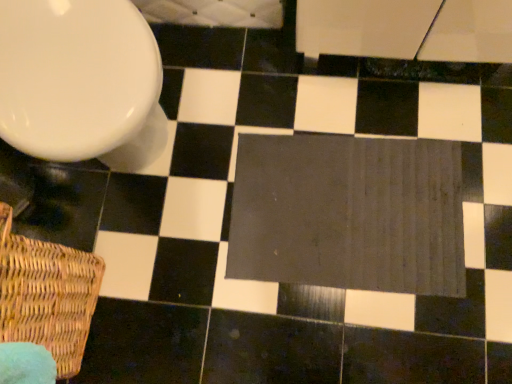
Question: Does dark gray fabric bath mat at center appear on the left side of woven brown basket at lower left?

Choices:
 (A) yes
 (B) no

Answer: (B)

Question: From the image's perspective, is dark gray fabric bath mat at center over woven brown basket at lower left?

Choices:
 (A) yes
 (B) no

Answer: (A)

Question: Is there a large distance between dark gray fabric bath mat at center and woven brown basket at lower left?

Choices:
 (A) no
 (B) yes

Answer: (A)

Question: Considering the relative sizes of dark gray fabric bath mat at center and woven brown basket at lower left in the image provided, is dark gray fabric bath mat at center thinner than woven brown basket at lower left?

Choices:
 (A) yes
 (B) no

Answer: (B)

Question: Is dark gray fabric bath mat at center bigger than woven brown basket at lower left?

Choices:
 (A) no
 (B) yes

Answer: (A)

Question: From a real-world perspective, is white glossy toilet at upper left physically located above or below dark gray fabric bath mat at center?

Choices:
 (A) above
 (B) below

Answer: (A)

Question: From the image's perspective, is white glossy toilet at upper left above or below dark gray fabric bath mat at center?

Choices:
 (A) above
 (B) below

Answer: (A)

Question: Is white glossy toilet at upper left inside the boundaries of dark gray fabric bath mat at center, or outside?

Choices:
 (A) outside
 (B) inside

Answer: (A)

Question: Visually, is white glossy toilet at upper left positioned to the left or to the right of dark gray fabric bath mat at center?

Choices:
 (A) left
 (B) right

Answer: (A)

Question: Considering the positions of dark gray fabric bath mat at center and white glossy toilet at upper left in the image, is dark gray fabric bath mat at center bigger or smaller than white glossy toilet at upper left?

Choices:
 (A) big
 (B) small

Answer: (B)

Question: From a real-world perspective, is dark gray fabric bath mat at center above or below white glossy toilet at upper left?

Choices:
 (A) above
 (B) below

Answer: (B)

Question: From the image's perspective, is dark gray fabric bath mat at center above or below white glossy toilet at upper left?

Choices:
 (A) below
 (B) above

Answer: (A)

Question: Is dark gray fabric bath mat at center wider or thinner than white glossy toilet at upper left?

Choices:
 (A) thin
 (B) wide

Answer: (A)

Question: Considering the positions of point (56, 329) and point (259, 266), is point (56, 329) closer or farther from the camera than point (259, 266)?

Choices:
 (A) farther
 (B) closer

Answer: (B)

Question: Considering the positions of woven brown basket at lower left and dark gray fabric bath mat at center in the image, is woven brown basket at lower left bigger or smaller than dark gray fabric bath mat at center?

Choices:
 (A) big
 (B) small

Answer: (A)